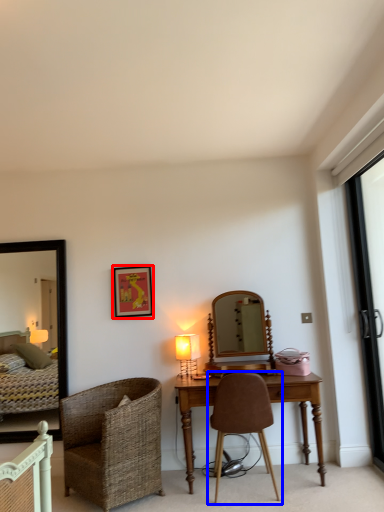
Question: Which point is further to the camera, picture frame (highlighted by a red box) or chair (highlighted by a blue box)?

Choices:
 (A) picture frame
 (B) chair

Answer: (A)